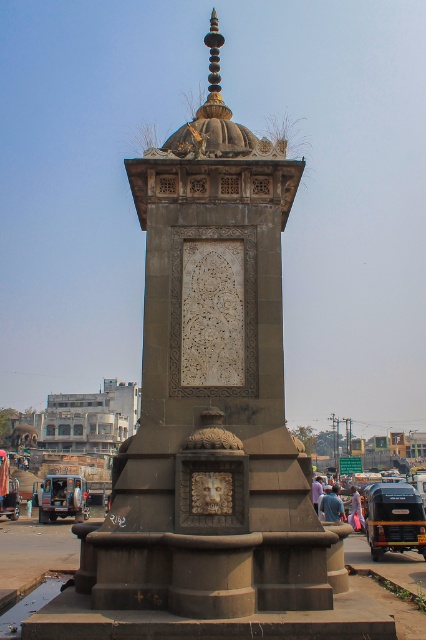
You are a delivery driver who needs to park your vehicle in this area. You see a blue metallic van at lower left and a metallic car at center. Which vehicle takes up more space horizontally?

The blue metallic van at lower left is wider than the metallic car at center, so it takes up more horizontal space.

You are a pedestrian standing at the monument and want to cross the road to reach the park on the other side. There is a metallic blue truck at lower right and a metallic car at center blocking your path. Which vehicle should you avoid stepping over first?

You should avoid stepping over the metallic blue truck at lower right first because it is positioned over the metallic car at center, meaning it is closer to you.

Consider the image. You are a photographer standing in front of the monument. You want to take a photo that includes both the metallic blue truck at lower right and the metallic car at center without any obstructions. Since you have a wide angle lens, which vehicle should you focus on to ensure both are in frame?

The metallic blue truck at lower right is much taller than the metallic car at center, so focusing on the metallic blue truck at lower right will ensure both vehicles are captured in the frame without obstruction.